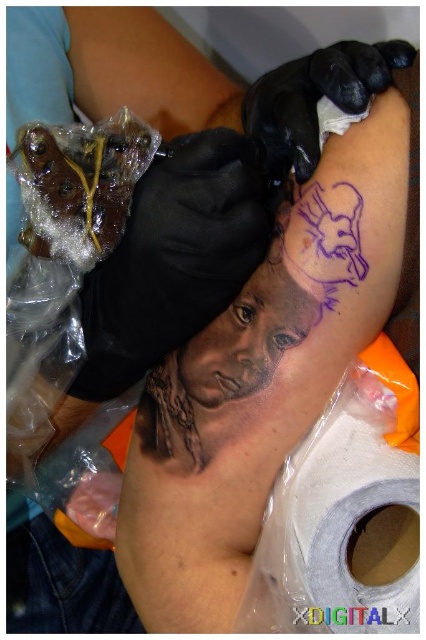
Question: Is white matte toilet paper at lower right positioned before translucent plastic at lower left?

Choices:
 (A) yes
 (B) no

Answer: (A)

Question: Which of the following is the closest to the observer?

Choices:
 (A) black rubber glove at upper center
 (B) purple ink tattoo at upper center
 (C) white matte toilet paper at lower right

Answer: (C)

Question: Which is farther from the translucent plastic at lower left?

Choices:
 (A) black matte portrait at center
 (B) white matte toilet paper at lower right

Answer: (B)

Question: Can you confirm if purple ink tattoo at upper center is positioned to the left of translucent plastic at lower left?

Choices:
 (A) yes
 (B) no

Answer: (B)

Question: Which point is closer to the camera?

Choices:
 (A) (94, 506)
 (B) (293, 202)

Answer: (B)

Question: Does purple ink tattoo at upper right appear under black matte portrait at center?

Choices:
 (A) no
 (B) yes

Answer: (A)